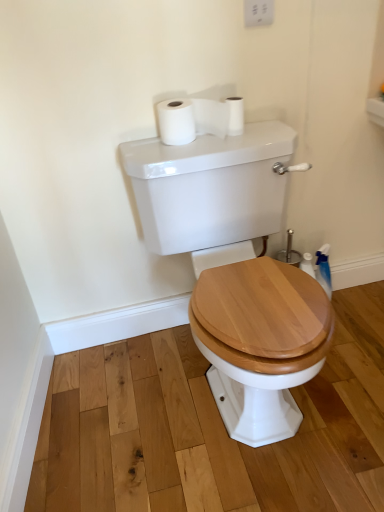
The height and width of the screenshot is (512, 384). What do you see at coordinates (260, 343) in the screenshot?
I see `white glossy porcelain at center` at bounding box center [260, 343].

The height and width of the screenshot is (512, 384). Identify the location of white plastic switch at upper center. (258, 12).

Where is `toilet paper that is behind the white matte toilet paper at upper center, the second toilet paper in the right-to-left sequence`? Image resolution: width=384 pixels, height=512 pixels. toilet paper that is behind the white matte toilet paper at upper center, the second toilet paper in the right-to-left sequence is located at coordinates (235, 116).

Looking at this image, from the image's perspective, is white matte toilet paper at upper center, the second toilet paper in the right-to-left sequence, above white matte toilet paper at upper center, which ranks as the second toilet paper in left-to-right order?

Actually, white matte toilet paper at upper center, the second toilet paper in the right-to-left sequence, appears below white matte toilet paper at upper center, which ranks as the second toilet paper in left-to-right order, in the image.

Is white matte toilet paper at upper center, which is the first toilet paper from left to right, spatially inside white matte toilet paper at upper center, which ranks as the second toilet paper in left-to-right order, or outside of it?

white matte toilet paper at upper center, which is the first toilet paper from left to right, is not inside white matte toilet paper at upper center, which ranks as the second toilet paper in left-to-right order, it's outside.

From a real-world perspective, is white matte toilet paper at upper center, the second toilet paper in the right-to-left sequence, on top of white matte toilet paper at upper center, which ranks as the second toilet paper in left-to-right order?

Yes, from a real-world perspective, white matte toilet paper at upper center, the second toilet paper in the right-to-left sequence, is over white matte toilet paper at upper center, which ranks as the second toilet paper in left-to-right order

From the image's perspective, is white matte toilet paper at upper center, which ranks as the second toilet paper in left-to-right order, on top of white plastic switch at upper center?

Incorrect, from the image's perspective, white matte toilet paper at upper center, which ranks as the second toilet paper in left-to-right order, is lower than white plastic switch at upper center.

Looking at this image, considering the relative sizes of white matte toilet paper at upper center, placed as the 1th toilet paper when sorted from right to left, and white plastic switch at upper center in the image provided, is white matte toilet paper at upper center, placed as the 1th toilet paper when sorted from right to left, shorter than white plastic switch at upper center?

Indeed, white matte toilet paper at upper center, placed as the 1th toilet paper when sorted from right to left, has a lesser height compared to white plastic switch at upper center.

Find the location of a particular element. electric outlet in front of the white matte toilet paper at upper center, placed as the 1th toilet paper when sorted from right to left is located at coordinates (258, 12).

Is white matte toilet paper at upper center, which ranks as the second toilet paper in left-to-right order, facing away from white plastic switch at upper center?

No, white matte toilet paper at upper center, which ranks as the second toilet paper in left-to-right order,'s orientation is not away from white plastic switch at upper center.

Is white matte toilet paper at upper center, which ranks as the second toilet paper in left-to-right order, further to camera compared to white glossy porcelain at center?

Yes, white matte toilet paper at upper center, which ranks as the second toilet paper in left-to-right order, is further from the camera.

From a real-world perspective, which object rests below the other?

white glossy porcelain at center is physically lower.

In terms of height, does white matte toilet paper at upper center, which ranks as the second toilet paper in left-to-right order, look taller or shorter compared to white glossy porcelain at center?

Considering their sizes, white matte toilet paper at upper center, which ranks as the second toilet paper in left-to-right order, has less height than white glossy porcelain at center.

Which toilet paper is the 1st one when counting from the left side of the white glossy porcelain at center? Please provide its 2D coordinates.

[(235, 116)]

From the image's perspective, between white matte toilet paper at upper center, placed as the 1th toilet paper when sorted from right to left, and white matte toilet paper at upper center, which is the first toilet paper from left to right, which one is located above?

white matte toilet paper at upper center, placed as the 1th toilet paper when sorted from right to left, from the image's perspective.

Measure the distance from white matte toilet paper at upper center, placed as the 1th toilet paper when sorted from right to left, to white matte toilet paper at upper center, the second toilet paper in the right-to-left sequence.

The distance of white matte toilet paper at upper center, placed as the 1th toilet paper when sorted from right to left, from white matte toilet paper at upper center, the second toilet paper in the right-to-left sequence, is 3.25 inches.

The image size is (384, 512). In order to click on toilet paper located on the left of white matte toilet paper at upper center, which ranks as the second toilet paper in left-to-right order in this screenshot , I will do `click(199, 119)`.

Which of these two, white plastic switch at upper center or white matte toilet paper at upper center, placed as the 1th toilet paper when sorted from right to left, stands shorter?

white matte toilet paper at upper center, placed as the 1th toilet paper when sorted from right to left, is shorter.

From the picture: How far apart are white plastic switch at upper center and white matte toilet paper at upper center, which ranks as the second toilet paper in left-to-right order?

white plastic switch at upper center is 9.93 inches from white matte toilet paper at upper center, which ranks as the second toilet paper in left-to-right order.

Is point (268, 6) farther from viewer compared to point (234, 125)?

No, (268, 6) is closer to viewer.

Is point (134, 178) closer or farther from the camera than point (259, 0)?

Point (134, 178) is farther from the camera than point (259, 0).

In the scene shown: Would you say white glossy porcelain at center contains white plastic switch at upper center?

No.

Does white glossy porcelain at center have a greater height compared to white plastic switch at upper center?

Yes.

Between white glossy porcelain at center and white plastic switch at upper center, which one is positioned in front?

white glossy porcelain at center.

From a real-world perspective, is white matte toilet paper at upper center, which is the first toilet paper from left to right, above or below white plastic switch at upper center?

white matte toilet paper at upper center, which is the first toilet paper from left to right, is below white plastic switch at upper center.

Which is behind, point (207, 110) or point (251, 23)?

Point (207, 110)

Which object is further away from the camera, white matte toilet paper at upper center, the second toilet paper in the right-to-left sequence, or white plastic switch at upper center?

white matte toilet paper at upper center, the second toilet paper in the right-to-left sequence, is more distant.

Is white matte toilet paper at upper center, which is the first toilet paper from left to right, inside or outside of white plastic switch at upper center?

The correct answer is: outside.

Find the location of a particular element. The height and width of the screenshot is (512, 384). toilet paper located above the white matte toilet paper at upper center, placed as the 1th toilet paper when sorted from right to left (from a real-world perspective) is located at coordinates coord(199,119).

I want to click on the 1st toilet paper to the left of the white plastic switch at upper center, starting your count from the anchor, so click(x=235, y=116).

Looking at the image, which one is located further to white matte toilet paper at upper center, the second toilet paper in the right-to-left sequence, white glossy porcelain at center or white plastic switch at upper center?

white plastic switch at upper center is positioned further to the anchor white matte toilet paper at upper center, the second toilet paper in the right-to-left sequence.

When comparing their distances from white plastic switch at upper center, does white matte toilet paper at upper center, the second toilet paper in the right-to-left sequence, or white matte toilet paper at upper center, placed as the 1th toilet paper when sorted from right to left, seem closer?

white matte toilet paper at upper center, placed as the 1th toilet paper when sorted from right to left, is positioned closer to the anchor white plastic switch at upper center.

Looking at the image, which one is located further to white matte toilet paper at upper center, the second toilet paper in the right-to-left sequence, white plastic switch at upper center or white matte toilet paper at upper center, placed as the 1th toilet paper when sorted from right to left?

Among the two, white plastic switch at upper center is located further to white matte toilet paper at upper center, the second toilet paper in the right-to-left sequence.

Consider the image. Based on their spatial positions, is white matte toilet paper at upper center, placed as the 1th toilet paper when sorted from right to left, or white matte toilet paper at upper center, the second toilet paper in the right-to-left sequence, closer to white plastic switch at upper center?

The object closer to white plastic switch at upper center is white matte toilet paper at upper center, placed as the 1th toilet paper when sorted from right to left.

Which object lies nearer to the anchor point white glossy porcelain at center, white matte toilet paper at upper center, the second toilet paper in the right-to-left sequence, or white matte toilet paper at upper center, which ranks as the second toilet paper in left-to-right order?

Based on the image, white matte toilet paper at upper center, the second toilet paper in the right-to-left sequence, appears to be nearer to white glossy porcelain at center.

When comparing their distances from white glossy porcelain at center, does white matte toilet paper at upper center, the second toilet paper in the right-to-left sequence, or white plastic switch at upper center seem further?

Based on the image, white plastic switch at upper center appears to be further to white glossy porcelain at center.

From the picture: When comparing their distances from white glossy porcelain at center, does white matte toilet paper at upper center, placed as the 1th toilet paper when sorted from right to left, or white matte toilet paper at upper center, which is the first toilet paper from left to right, seem further?

Based on the image, white matte toilet paper at upper center, placed as the 1th toilet paper when sorted from right to left, appears to be further to white glossy porcelain at center.

From the image, which object appears to be nearer to white matte toilet paper at upper center, which is the first toilet paper from left to right, white glossy porcelain at center or white matte toilet paper at upper center, which ranks as the second toilet paper in left-to-right order?

white matte toilet paper at upper center, which ranks as the second toilet paper in left-to-right order.

This screenshot has width=384, height=512. What are the coordinates of `toilet paper between white matte toilet paper at upper center, which ranks as the second toilet paper in left-to-right order, and white glossy porcelain at center in the up-down direction` in the screenshot? It's located at (199, 119).

Locate an element on the screen. This screenshot has height=512, width=384. toilet paper between white plastic switch at upper center and white matte toilet paper at upper center, the second toilet paper in the right-to-left sequence, in the vertical direction is located at coordinates (235, 116).